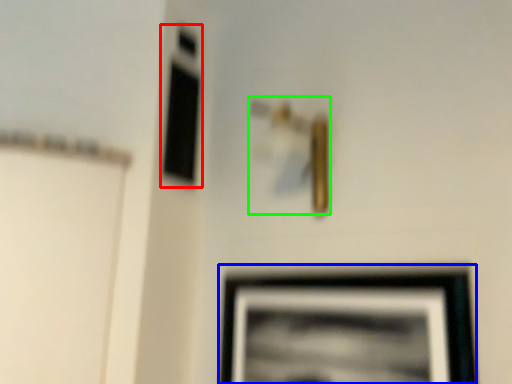
Question: Considering the real-world distances, which object is closest to window (highlighted by a red box)? picture frame (highlighted by a blue box) or door handle (highlighted by a green box).

Choices:
 (A) picture frame
 (B) door handle

Answer: (B)